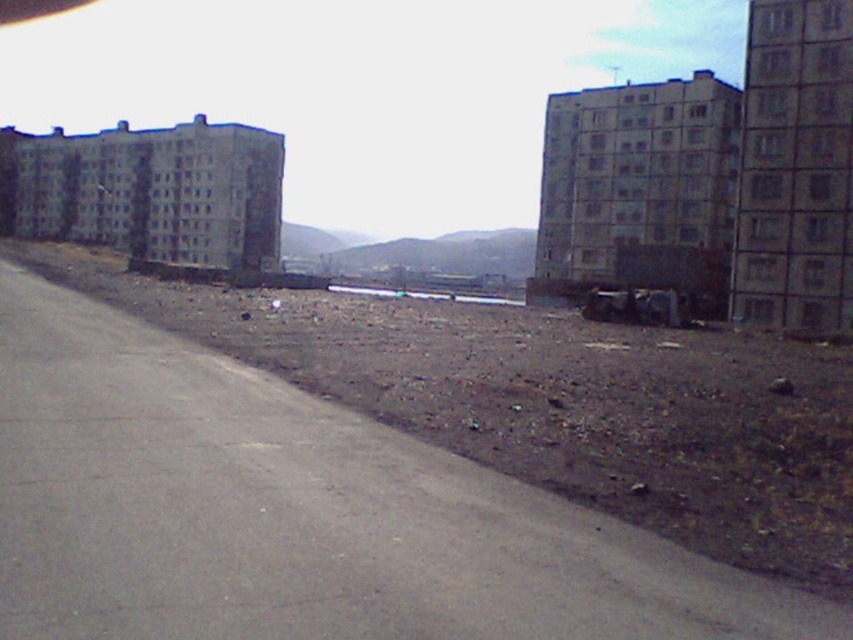
Question: Does brown dirt at lower left have a larger size compared to gray concrete building at upper right?

Choices:
 (A) yes
 (B) no

Answer: (A)

Question: Which point appears farthest from the camera in this image?

Choices:
 (A) (596, 257)
 (B) (370, 305)

Answer: (A)

Question: Does brown dirt at lower left appear on the right side of gray concrete building at upper right?

Choices:
 (A) yes
 (B) no

Answer: (B)

Question: Does brown dirt at lower left have a smaller size compared to gray concrete building at upper right?

Choices:
 (A) yes
 (B) no

Answer: (B)

Question: Among these objects, which one is farthest from the camera?

Choices:
 (A) gray concrete building at upper right
 (B) brown dirt at lower left

Answer: (A)